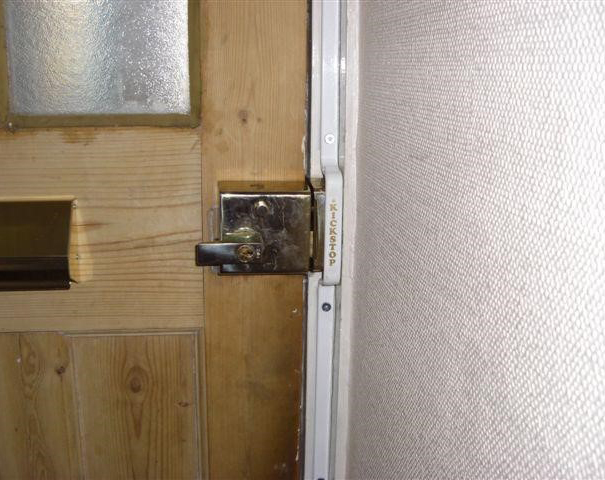
You are a GUI agent. You are given a task and a screenshot of the screen. Output one action in this format:
    pyautogui.click(x=<x>, y=<y>)
    Task: Click on the window
    This screenshot has width=605, height=480.
    Given the screenshot: What is the action you would take?
    pyautogui.click(x=132, y=72)